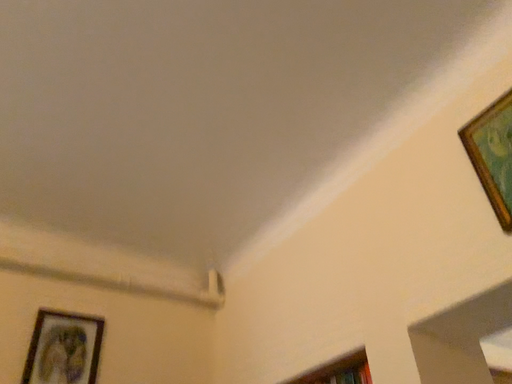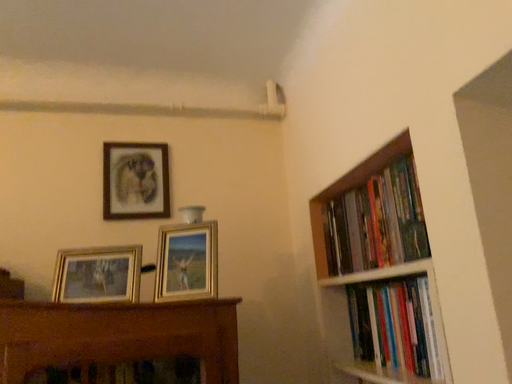
Question: How did the camera likely rotate when shooting the video?

Choices:
 (A) rotated upward
 (B) rotated downward

Answer: (B)